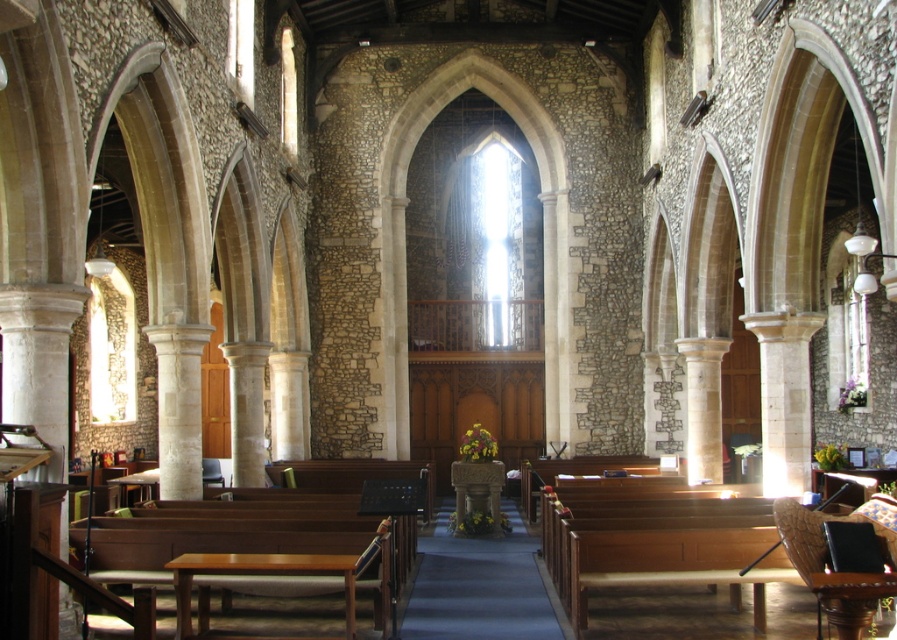
Looking at this image, is wooden polished bench at lower right smaller than leather cushioned chair at lower right?

Incorrect, wooden polished bench at lower right is not smaller in size than leather cushioned chair at lower right.

Is wooden polished bench at lower right closer to the viewer compared to leather cushioned chair at lower right?

No.

The width and height of the screenshot is (897, 640). What do you see at coordinates (655, 541) in the screenshot?
I see `wooden polished bench at lower right` at bounding box center [655, 541].

Locate an element on the screen. wooden polished bench at lower right is located at coordinates (655, 541).